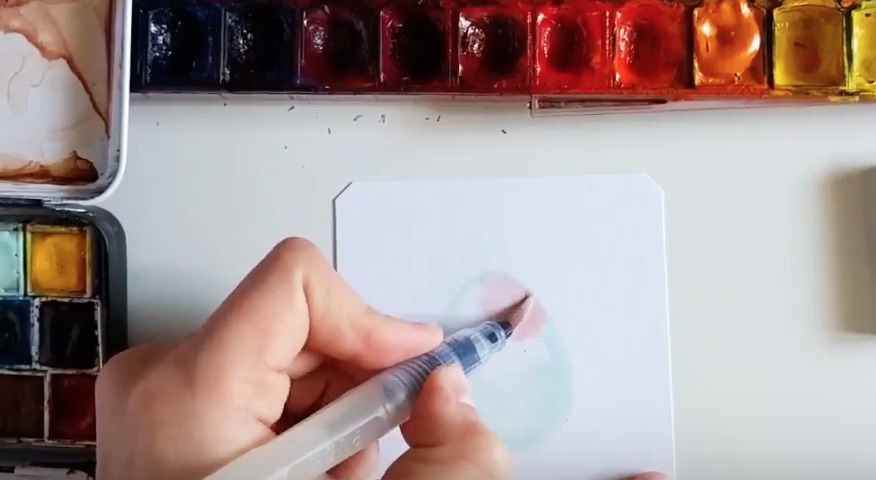
Where is `dark orange paint`? Image resolution: width=876 pixels, height=480 pixels. dark orange paint is located at coordinates (646, 64).